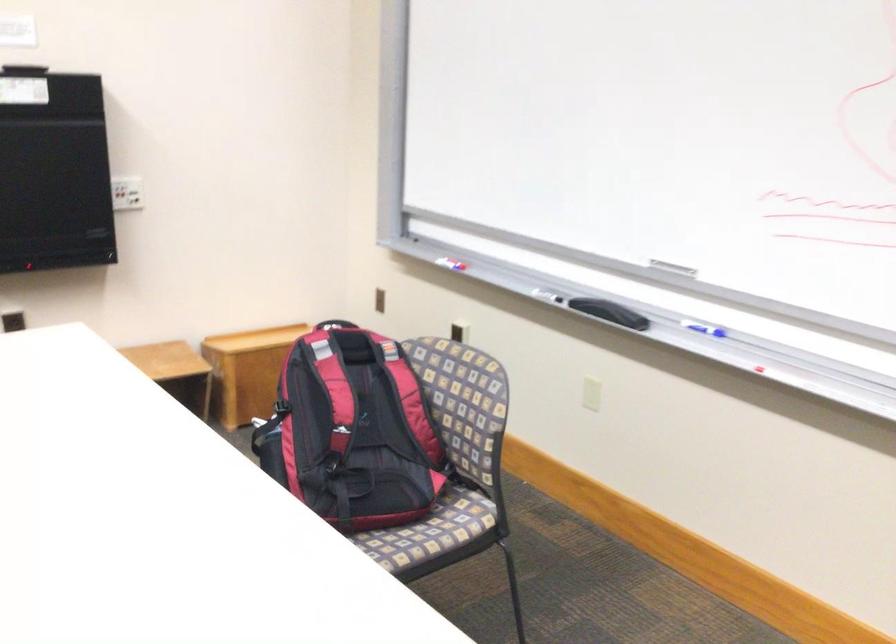
The height and width of the screenshot is (644, 896). I want to click on blue whiteboard marker, so click(x=702, y=328).